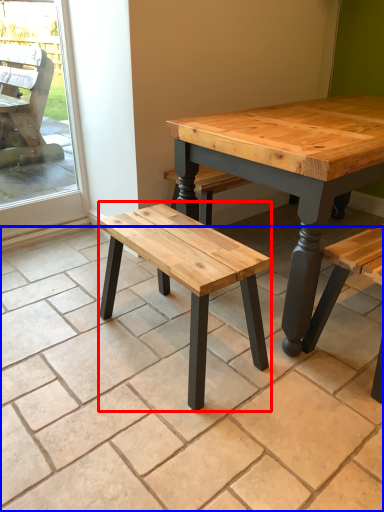
Question: Which point is further to the camera, stool (highlighted by a red box) or tile (highlighted by a blue box)?

Choices:
 (A) stool
 (B) tile

Answer: (A)